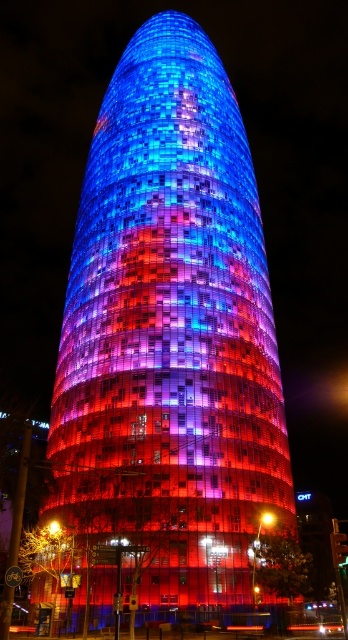
Question: Which point is closer to the camera taking this photo?

Choices:
 (A) (272, 522)
 (B) (135, 566)

Answer: (B)

Question: Is the position of shiny glass tower at center less distant than that of matte glass light at center?

Choices:
 (A) no
 (B) yes

Answer: (B)

Question: Does shiny glass tower at center appear under matte glass light at center?

Choices:
 (A) yes
 (B) no

Answer: (B)

Question: Is shiny glass tower at center above matte glass light at center?

Choices:
 (A) no
 (B) yes

Answer: (B)

Question: Which point is farther to the camera?

Choices:
 (A) shiny glass tower at center
 (B) matte glass light at center

Answer: (B)

Question: Which of the following is the farthest from the observer?

Choices:
 (A) (202, 324)
 (B) (259, 518)

Answer: (A)